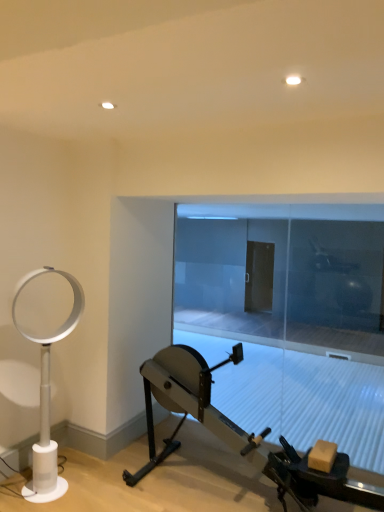
Question: Can you confirm if metallic silver stationary bicycle at center is shorter than white plastic fan at left?

Choices:
 (A) yes
 (B) no

Answer: (A)

Question: Does metallic silver stationary bicycle at center have a greater height compared to white plastic fan at left?

Choices:
 (A) yes
 (B) no

Answer: (B)

Question: From the image's perspective, is metallic silver stationary bicycle at center on white plastic fan at left?

Choices:
 (A) no
 (B) yes

Answer: (A)

Question: Does metallic silver stationary bicycle at center have a lesser width compared to white plastic fan at left?

Choices:
 (A) no
 (B) yes

Answer: (A)

Question: Is metallic silver stationary bicycle at center positioned far away from white plastic fan at left?

Choices:
 (A) no
 (B) yes

Answer: (B)

Question: Is white plastic fan at left completely or partially inside metallic silver stationary bicycle at center?

Choices:
 (A) no
 (B) yes

Answer: (A)

Question: Does transparent glass door at center turn towards white plastic fan at left?

Choices:
 (A) yes
 (B) no

Answer: (A)

Question: Is transparent glass door at center far away from white plastic fan at left?

Choices:
 (A) yes
 (B) no

Answer: (A)

Question: From the image's perspective, is transparent glass door at center located above white plastic fan at left?

Choices:
 (A) no
 (B) yes

Answer: (B)

Question: Can we say transparent glass door at center lies outside white plastic fan at left?

Choices:
 (A) yes
 (B) no

Answer: (A)

Question: Are transparent glass door at center and white plastic fan at left making contact?

Choices:
 (A) yes
 (B) no

Answer: (B)

Question: From a real-world perspective, is transparent glass door at center below white plastic fan at left?

Choices:
 (A) no
 (B) yes

Answer: (A)

Question: Can you confirm if transparent glass door at center is positioned to the left of metallic silver stationary bicycle at center?

Choices:
 (A) yes
 (B) no

Answer: (B)